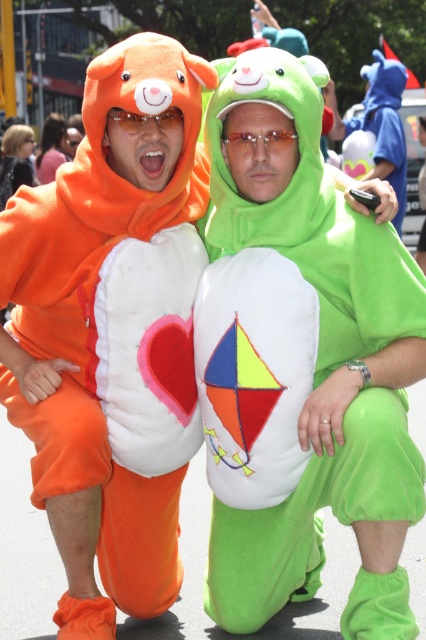
You are a costume designer trying to decide which pair of goggles to use for a character. The transparent plastic goggles at center and the matte plastic goggles at upper center are options. Which pair is wider?

The transparent plastic goggles at center is wider than the matte plastic goggles at upper center.

You are a costume designer trying to place a new accessory between the transparent plastic goggles at center and the matte plastic goggles at upper center. Based on their sizes, where should you place the new accessory to ensure it fits between them?

The transparent plastic goggles at center is much taller than the matte plastic goggles at upper center, so you should place the new accessory between them in a position that accommodates the height difference, possibly closer to the shorter matte plastic goggles at upper center to avoid blocking the taller transparent ones.

You are a photographer standing at a safe distance of 5 meters from the scene. You want to take a closeup shot of the transparent plastic goggles at center. Can you reach the goggles with a standard camera lens that has a maximum zoom of 5 meters? Please explain your reasoning.

The transparent plastic goggles at center are 4.03 meters away from the viewer. Since the camera lens can zoom up to 5 meters, which is farther than the goggles distance, the photographer can take a closeup shot.